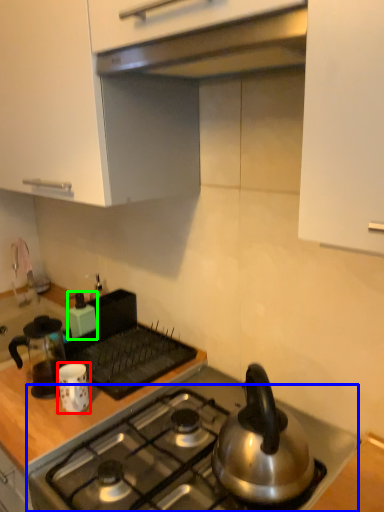
Question: Based on their relative distances, which object is farther from kitchen appliance (highlighted by a red box)? Choose from gas stove (highlighted by a blue box) and kitchen appliance (highlighted by a green box).

Choices:
 (A) gas stove
 (B) kitchen appliance

Answer: (B)